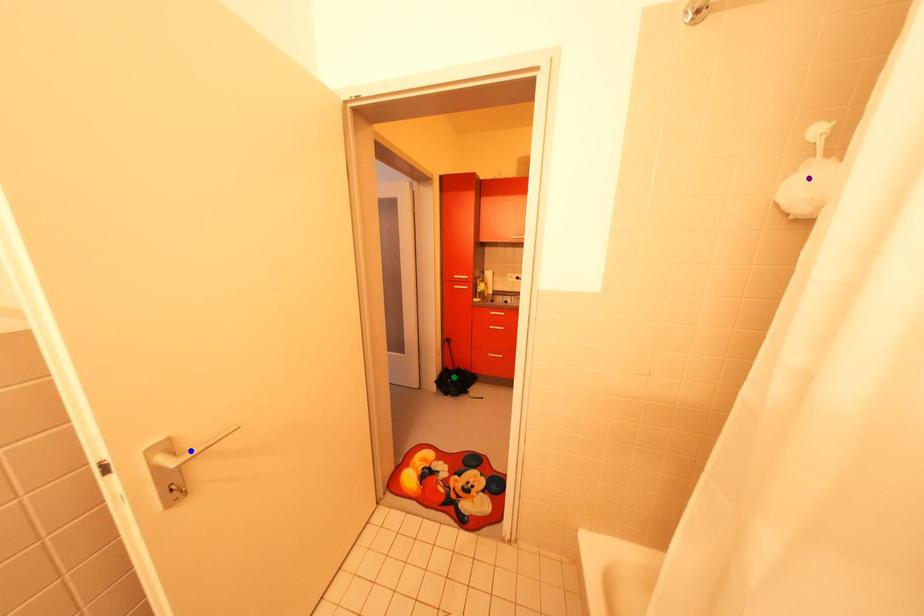
Order these from nearest to farthest:
A) blue point
B) purple point
C) green point

blue point < purple point < green point